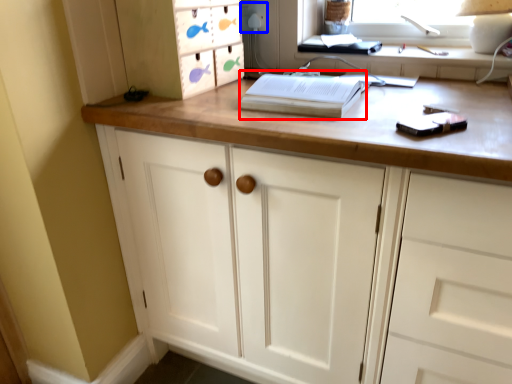
Question: Which object is further to the camera taking this photo, paperback book (highlighted by a red box) or electric outlet (highlighted by a blue box)?

Choices:
 (A) paperback book
 (B) electric outlet

Answer: (B)